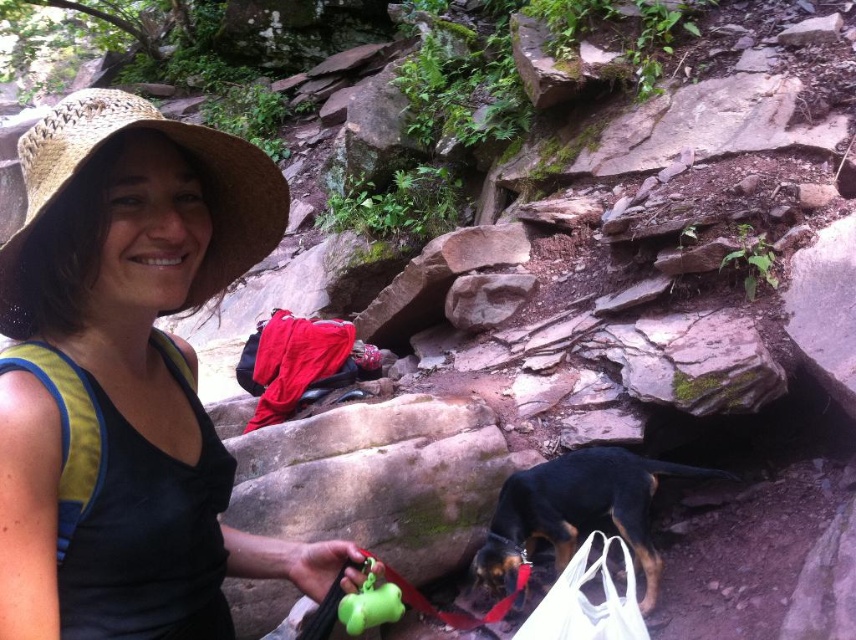
Is point (613, 493) farther from viewer compared to point (629, 616)?

Yes, point (613, 493) is farther from viewer.

Is point (705, 476) closer to viewer compared to point (551, 600)?

No.

This screenshot has width=856, height=640. I want to click on black and tan fur dog at lower right, so click(577, 512).

Is straw hat at upper left above black and tan fur dog at lower right?

Yes, straw hat at upper left is above black and tan fur dog at lower right.

Who is more forward, (x=236, y=230) or (x=559, y=472)?

Positioned in front is point (x=236, y=230).

The image size is (856, 640). I want to click on straw hat at upper left, so click(177, 144).

Who is lower down, natural straw hat at upper left or white fabric bag at lower right?

Positioned lower is white fabric bag at lower right.

Who is positioned more to the left, natural straw hat at upper left or white fabric bag at lower right?

natural straw hat at upper left

Who is more distant from viewer, (49, 236) or (633, 612)?

Positioned behind is point (633, 612).

You are a GUI agent. You are given a task and a screenshot of the screen. Output one action in this format:
    pyautogui.click(x=<x>, y=<y>)
    Task: Click on the natural straw hat at upper left
    This screenshot has height=640, width=856.
    Given the screenshot: What is the action you would take?
    pyautogui.click(x=141, y=266)